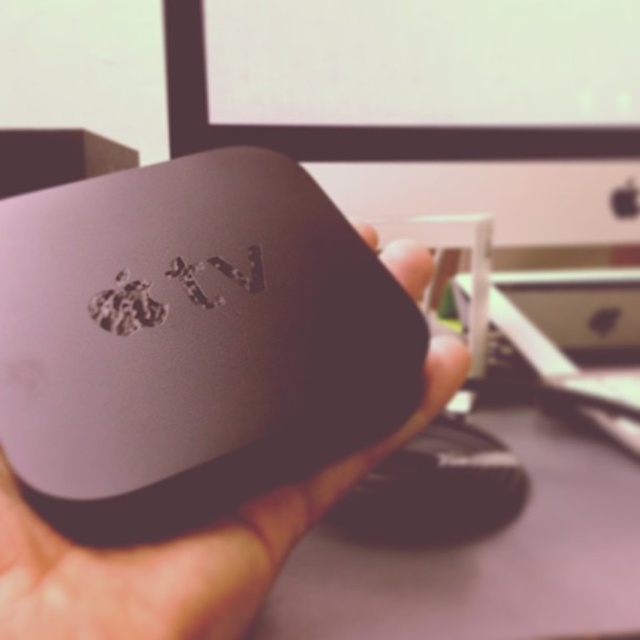
You are setting up a new entertainment system and have both the matte gray apple tv at center and the black matte mouse at center. Which device should you place closer to the edge of the desk to ensure there is enough space for both?

The black matte mouse at center should be placed closer to the edge since it is narrower than the matte gray apple tv at center, allowing more space for both devices.

You are setting up a home theater system and need to place the matte gray apple tv at center and the black matte mouse at center on a shelf. According to the image, which device should be placed to the left side of the shelf?

The matte gray apple tv at center should be placed to the left side of the shelf because it is positioned to the left of the black matte mouse at center in the image.